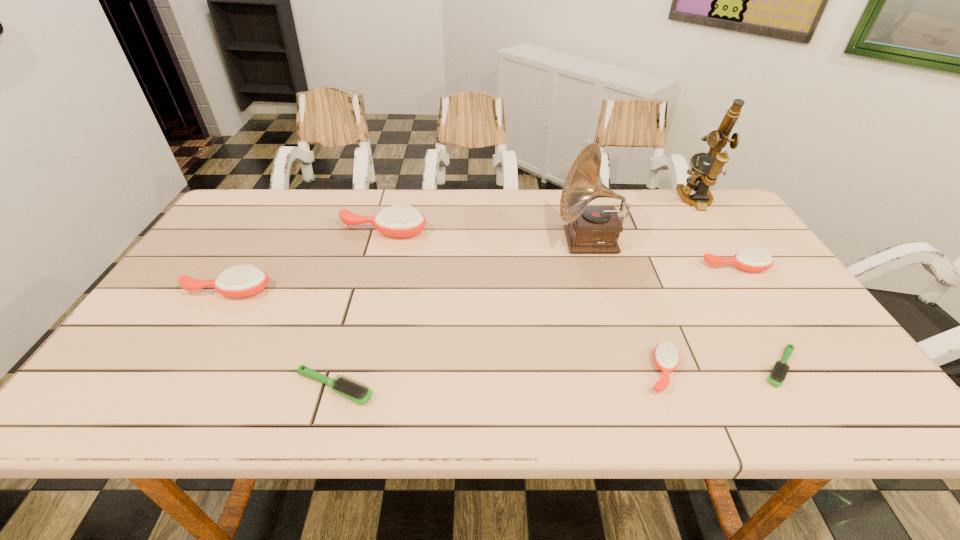
In order to click on hairbrush that is the fifth nearest to the smaller light hairbrush in this screenshot , I will do click(x=240, y=281).

Identify the location of orange hairbrush that is the third closest one to the microscope. (397, 221).

I want to click on orange hairbrush that is the closest one to the shortest hairbrush, so click(666, 357).

The width and height of the screenshot is (960, 540). I want to click on vacant space that satisfies the following two spatial constraints: 1. on the front side of the bigger light hairbrush; 2. on the left side of the fourth nearest object, so click(168, 387).

Image resolution: width=960 pixels, height=540 pixels. Find the location of `vacant space that satisfies the following two spatial constraints: 1. on the horn of the second tallest object; 2. on the left side of the nearest orange hairbrush`. vacant space that satisfies the following two spatial constraints: 1. on the horn of the second tallest object; 2. on the left side of the nearest orange hairbrush is located at coordinates (629, 372).

Where is `free space that satisfies the following two spatial constraints: 1. on the horn of the brown phonograph record; 2. on the left side of the smaller light hairbrush`? This screenshot has width=960, height=540. free space that satisfies the following two spatial constraints: 1. on the horn of the brown phonograph record; 2. on the left side of the smaller light hairbrush is located at coordinates (627, 367).

Image resolution: width=960 pixels, height=540 pixels. I want to click on vacant area that satisfies the following two spatial constraints: 1. on the back side of the farthest hairbrush; 2. on the left side of the second shortest object, so click(x=379, y=232).

At what (x,y) coordinates should I click in order to perform the action: click on free location that satisfies the following two spatial constraints: 1. on the horn of the brown phonograph record; 2. on the left side of the third hairbrush from right to left. Please return your answer as a coordinate pair (x, y). The width and height of the screenshot is (960, 540). Looking at the image, I should click on (629, 372).

This screenshot has height=540, width=960. Identify the location of free spot that satisfies the following two spatial constraints: 1. on the back side of the right light hairbrush; 2. on the right side of the seventh tallest object. [x=341, y=367].

Where is `free space that satisfies the following two spatial constraints: 1. on the back side of the second shortest object; 2. on the right side of the shortest hairbrush`? free space that satisfies the following two spatial constraints: 1. on the back side of the second shortest object; 2. on the right side of the shortest hairbrush is located at coordinates (341, 367).